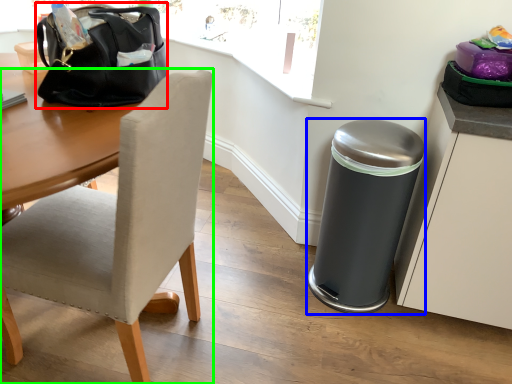
Question: Based on their relative distances, which object is nearer to handbag (highlighted by a red box)? Choose from trash bin/can (highlighted by a blue box) and chair (highlighted by a green box).

Choices:
 (A) trash bin/can
 (B) chair

Answer: (B)